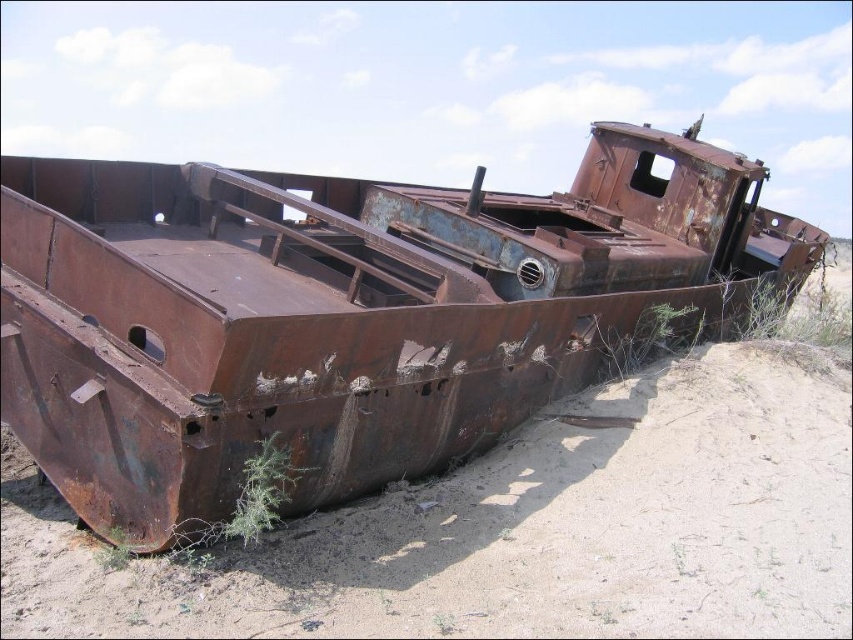
You are a gardener trying to plant a new shrub in the sandy terrain between the two abandoned boats. You notice the green fuzzy plant at lower center and the green leafy plant at lower right. Which plant has a smaller width and would require less space for planting?

The green fuzzy plant at lower center has a lesser width compared to the green leafy plant at lower right, so it requires less space for planting.

You are a gardener who wants to water both the green fuzzy plant at lower center and the green leafy plant at lower right. The watering can you have can only hold enough water to cover 15 feet. Can you water both plants without needing to refill the watering can?

The green fuzzy plant at lower center and green leafy plant at lower right are 16.04 feet apart, so the watering can can only cover 15 feet. Therefore, you will need to refill the watering can to water both plants.